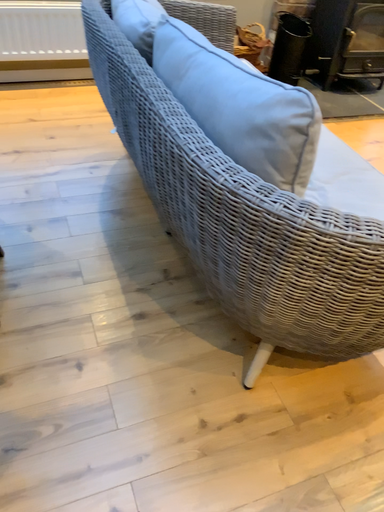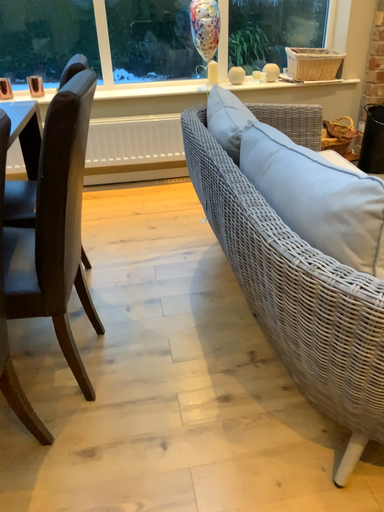
Question: Which way did the camera rotate in the video?

Choices:
 (A) rotated right
 (B) rotated left

Answer: (B)